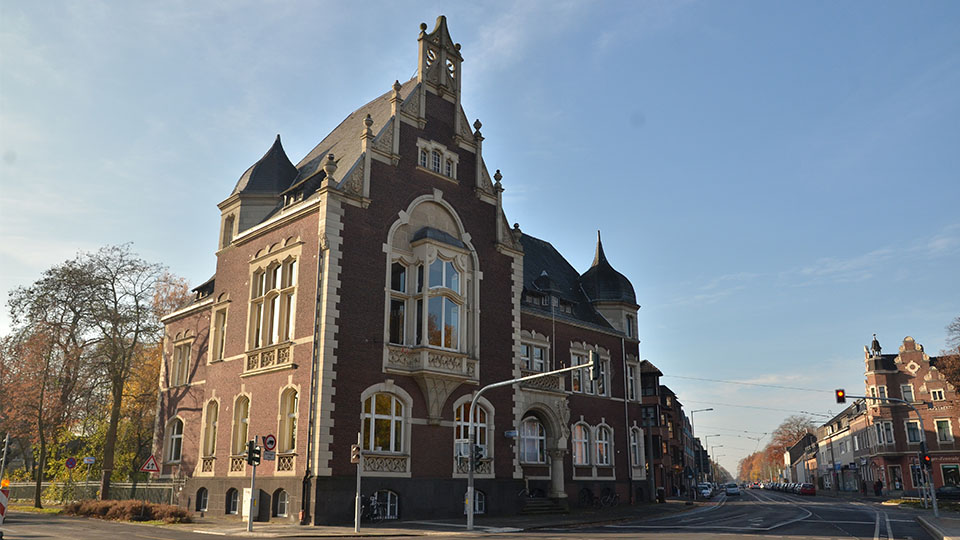
Locate an element on the screen. bay window is located at coordinates (420, 283), (442, 328).